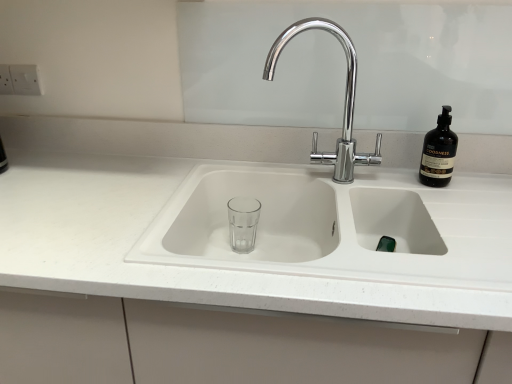
Question: From a real-world perspective, is chrome/metallic faucet at center above or below dark brown glass bottle at upper right?

Choices:
 (A) below
 (B) above

Answer: (B)

Question: Is chrome/metallic faucet at center wider or thinner than dark brown glass bottle at upper right?

Choices:
 (A) thin
 (B) wide

Answer: (B)

Question: Estimate the real-world distances between objects in this image. Which object is farther from the dark brown glass bottle at upper right?

Choices:
 (A) white matte countertop at center
 (B) chrome/metallic faucet at center

Answer: (A)

Question: Based on their relative distances, which object is nearer to the dark brown glass bottle at upper right?

Choices:
 (A) white matte countertop at center
 (B) chrome/metallic faucet at center

Answer: (B)